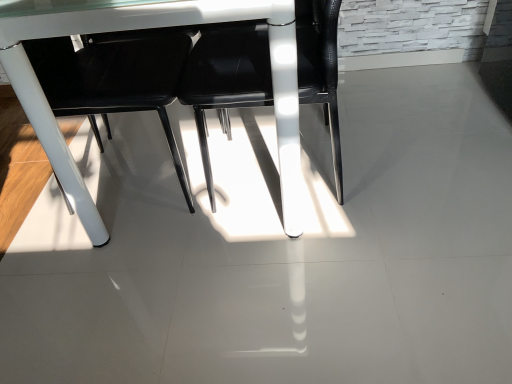
Question: From a real-world perspective, does black leather chair at center, which is the 1th chair from left to right, stand above white glossy table at center?

Choices:
 (A) yes
 (B) no

Answer: (A)

Question: Does black leather chair at center, which is the 1th chair from left to right, have a larger size compared to white glossy table at center?

Choices:
 (A) no
 (B) yes

Answer: (A)

Question: Would you say black leather chair at center, which is the 1th chair from left to right, is outside white glossy table at center?

Choices:
 (A) yes
 (B) no

Answer: (B)

Question: Are black leather chair at center, which is the 1th chair from left to right, and white glossy table at center far apart?

Choices:
 (A) no
 (B) yes

Answer: (A)

Question: Is white glossy table at center completely or partially inside black leather chair at center, which is the 1th chair from left to right?

Choices:
 (A) no
 (B) yes

Answer: (A)

Question: Considering the relative positions of black leather chair at center, which is the first chair from right to left, and black leather chair at center, which is the 1th chair from left to right, in the image provided, is black leather chair at center, which is the first chair from right to left, to the left or to the right of black leather chair at center, which is the 1th chair from left to right,?

Choices:
 (A) right
 (B) left

Answer: (A)

Question: Is black leather chair at center, which appears as the 2th chair when viewed from the left, bigger or smaller than black leather chair at center, which is the 1th chair from left to right?

Choices:
 (A) big
 (B) small

Answer: (B)

Question: In terms of height, does black leather chair at center, which is the first chair from right to left, look taller or shorter compared to black leather chair at center, which is the 1th chair from left to right?

Choices:
 (A) tall
 (B) short

Answer: (B)

Question: In the image, is black leather chair at center, which is the first chair from right to left, positioned in front of or behind black leather chair at center, which is the 1th chair from left to right?

Choices:
 (A) front
 (B) behind

Answer: (A)

Question: Do you think black leather chair at center, which is the 1th chair from left to right, is within black leather chair at center, which is the first chair from right to left, or outside of it?

Choices:
 (A) inside
 (B) outside

Answer: (B)

Question: Is black leather chair at center, the 2th chair positioned from the right, to the left or to the right of black leather chair at center, which appears as the 2th chair when viewed from the left, in the image?

Choices:
 (A) right
 (B) left

Answer: (B)

Question: In terms of width, does black leather chair at center, the 2th chair positioned from the right, look wider or thinner when compared to black leather chair at center, which appears as the 2th chair when viewed from the left?

Choices:
 (A) thin
 (B) wide

Answer: (B)

Question: Considering the positions of point (184, 39) and point (198, 66), is point (184, 39) closer or farther from the camera than point (198, 66)?

Choices:
 (A) farther
 (B) closer

Answer: (A)

Question: Is point (287, 201) positioned closer to the camera than point (302, 0)?

Choices:
 (A) farther
 (B) closer

Answer: (A)

Question: From their relative heights in the image, would you say white glossy table at center is taller or shorter than black leather chair at center, which appears as the 2th chair when viewed from the left?

Choices:
 (A) tall
 (B) short

Answer: (A)